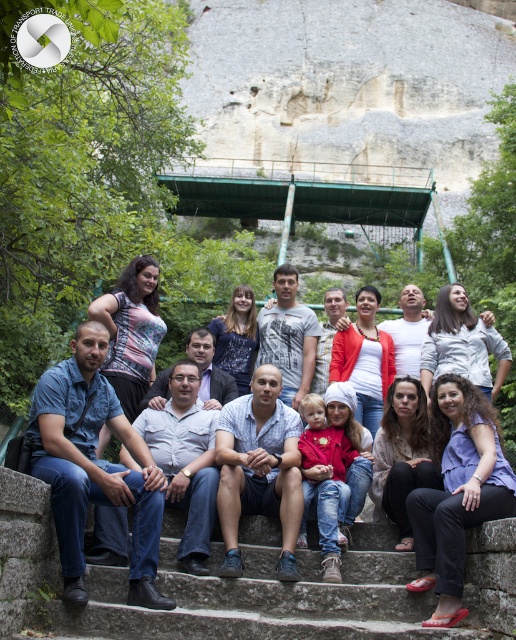
Based on the photo, you are standing at the point labeled as point (295, 593) in the image. What object are you standing on?

You are standing on the gray concrete stairs at lower center.

Based on the photo, you are taking a photo of the group and notice two points marked in the image. The first point is at coordinate point (x=120, y=588) and the second is at point (x=356, y=611). Which point is closer to the camera?

Point (x=120, y=588) is closer to the camera than point (x=356, y=611) because it is further to the camera than the second point.

You are standing at the bottom of the gray concrete stairs at lower center and want to reach the light blue denim jeans at center. Which direction should you move to get closer to the jeans?

You should move to the left because the gray concrete stairs at lower center is on the right side of the light blue denim jeans at center, so moving left would bring you closer to the jeans.